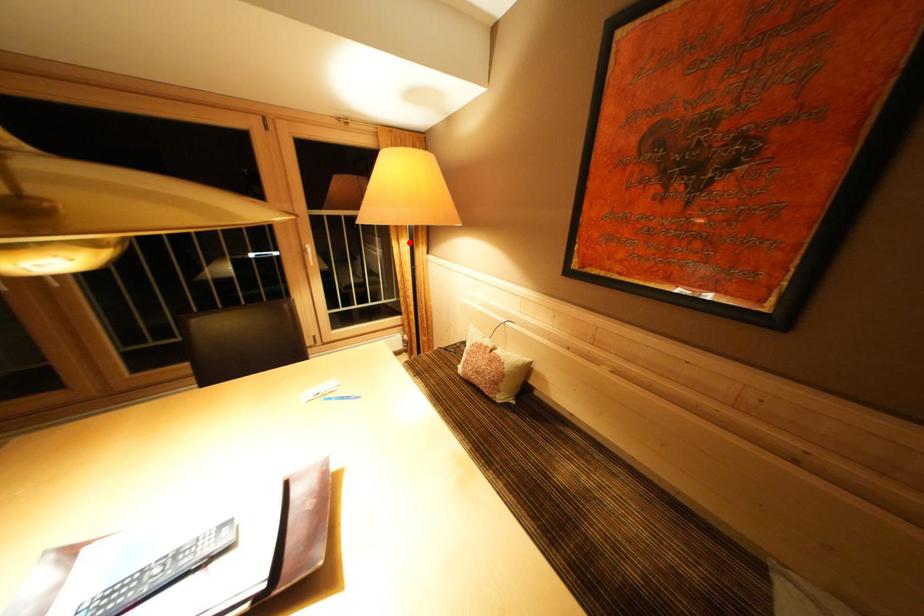
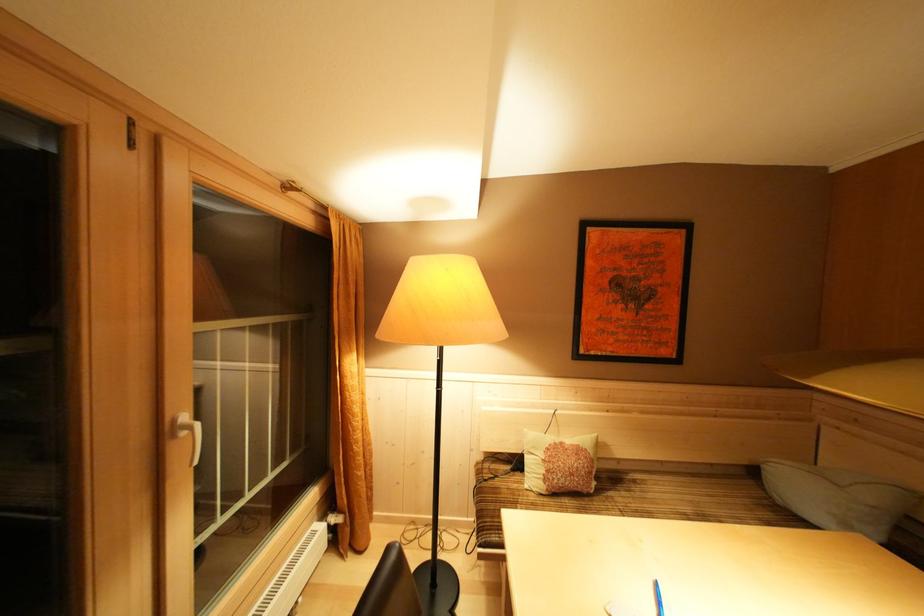
Question: I am providing you with two images of the same scene from different viewpoints. A red point is marked on the first image. Can you still see the location of the red point in image 2?

Choices:
 (A) Yes
 (B) No

Answer: (A)